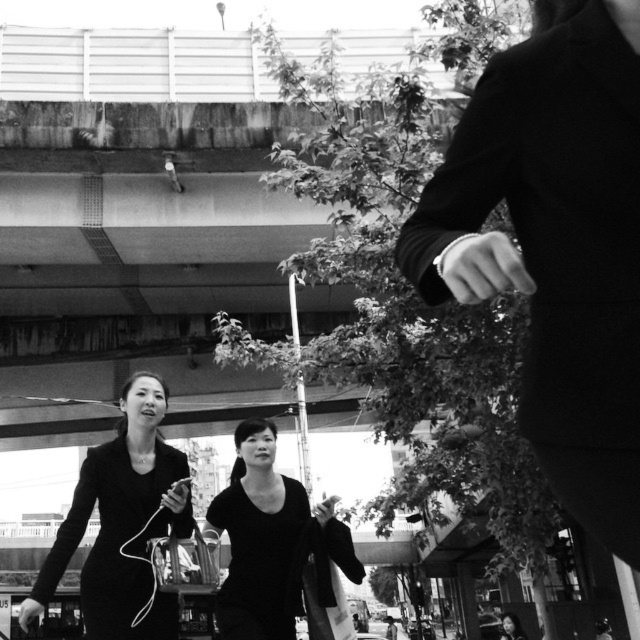
You are a photographer trying to capture the two dresses in the scene. Which dress, the black matte dress at center or the smooth black dress at lower center, is closer to the camera?

The black matte dress at center is closer to the camera because it is in front of the smooth black dress at lower center.

You are a fashion designer observing this urban street scene. You notice two individuals wearing dresses at the center of the image. The first is labeled as the matte black dress at center, and the second is the black matte dress at center. Which dress has a wider width according to the description?

The black matte dress at center has a wider width than the matte black dress at center as stated in the description.

You are a photographer adjusting your camera settings to focus on the matte black dress at center and the smooth black dress at lower center. Which dress should you focus on first to ensure both are in sharp focus?

The matte black dress at center is in front of the smooth black dress at lower center, so you should focus on the matte black dress at center first to ensure both are in sharp focus.